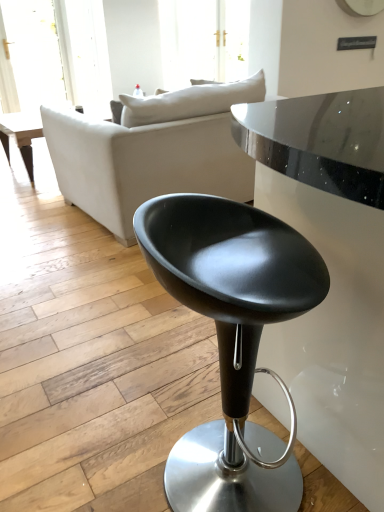
Question: Considering the positions of matte white couch at center and matte black stool at center in the image, is matte white couch at center wider or thinner than matte black stool at center?

Choices:
 (A) thin
 (B) wide

Answer: (B)

Question: Considering the positions of matte white couch at center and matte black stool at center in the image, is matte white couch at center taller or shorter than matte black stool at center?

Choices:
 (A) short
 (B) tall

Answer: (B)

Question: Considering the positions of matte white couch at center and matte black stool at center in the image, is matte white couch at center bigger or smaller than matte black stool at center?

Choices:
 (A) small
 (B) big

Answer: (B)

Question: From a real-world perspective, is matte black stool at center physically located above or below matte white couch at center?

Choices:
 (A) below
 (B) above

Answer: (A)

Question: Is point (244, 344) positioned closer to the camera than point (211, 111)?

Choices:
 (A) farther
 (B) closer

Answer: (B)

Question: Visually, is matte black stool at center positioned to the left or to the right of matte white couch at center?

Choices:
 (A) right
 (B) left

Answer: (A)

Question: Is matte black stool at center in front of or behind matte white couch at center in the image?

Choices:
 (A) front
 (B) behind

Answer: (A)